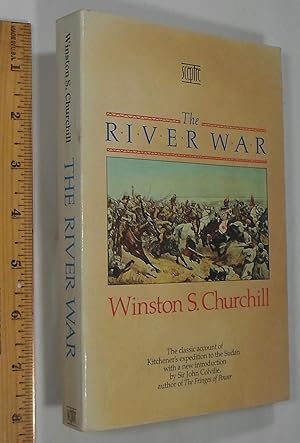
Where is `dark gray shadow cast by book`? dark gray shadow cast by book is located at coordinates (51, 371).